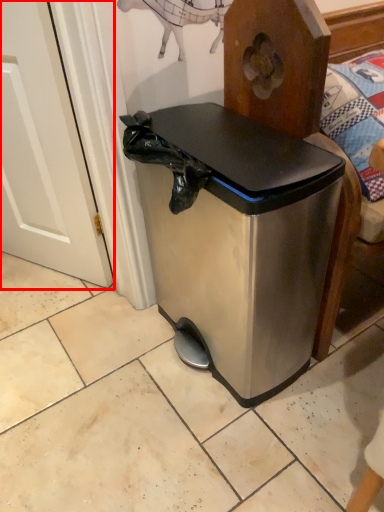
Question: Where is screen door (annotated by the red box) located in relation to waste container in the image?

Choices:
 (A) left
 (B) right

Answer: (A)